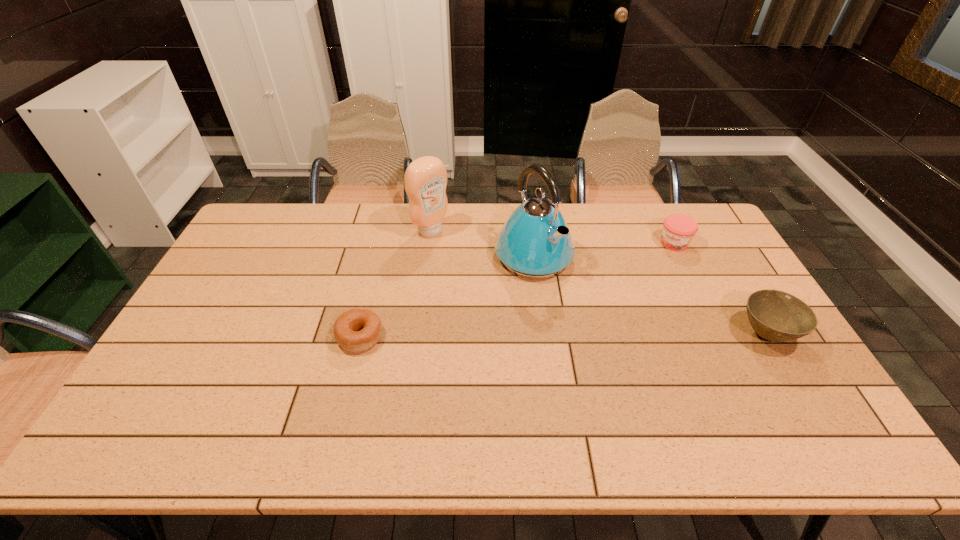
Locate an element on the screen. The width and height of the screenshot is (960, 540). free spot on the desktop that is between the leftmost object and the bowl and is positioned on the front label of the jam is located at coordinates (612, 335).

You are a GUI agent. You are given a task and a screenshot of the screen. Output one action in this format:
    pyautogui.click(x=<x>, y=<y>)
    Task: Click on the vacant space on the desktop that is between the leftmost object and the bowl and is positioned at the spout of the tallest object
    This screenshot has width=960, height=540.
    Given the screenshot: What is the action you would take?
    pyautogui.click(x=617, y=335)

This screenshot has width=960, height=540. What are the coordinates of `vacant space on the desktop that is between the bagel and the bowl and is positioned on the label of the fourth object from right to left` in the screenshot? It's located at (564, 335).